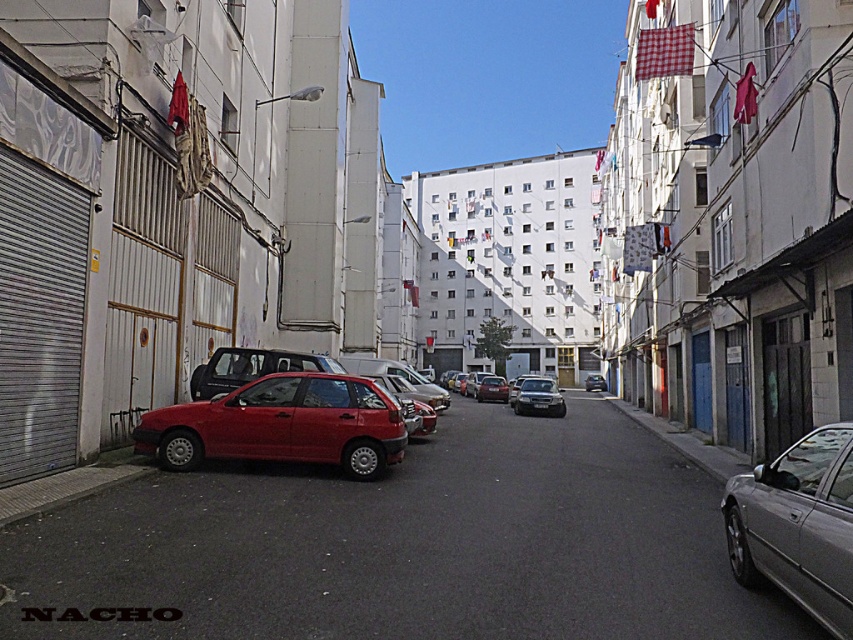
You are a delivery driver who needs to park your van between the metallic red car at center and the metallic silver sedan at center. Based on the scene description, which side should you park your van on to be between them?

The metallic red car at center is positioned on the left side of the metallic silver sedan at center. Therefore, to park between them, you should position your van to the right of the metallic red car at center and to the left of the metallic silver sedan at center.

You are a pedestrian standing at the edge of the street and want to cross to the other side. The matte red car at center and the black plastic license plate at center are in your path. Which object will you encounter first?

The matte red car at center is closer to you than the black plastic license plate at center, so you will encounter the matte red car at center first.

You are standing at the point marked by the coordinates point (281, 426). What object are you standing on?

The point (281, 426) is on the matte red hatchback at center.